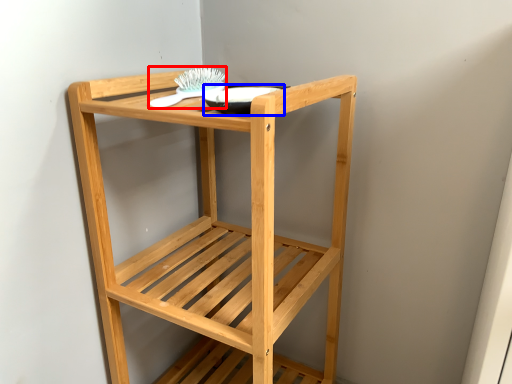
Question: Which point is closer to the camera, brush (highlighted by a red box) or glass bowl (highlighted by a blue box)?

Choices:
 (A) brush
 (B) glass bowl

Answer: (B)